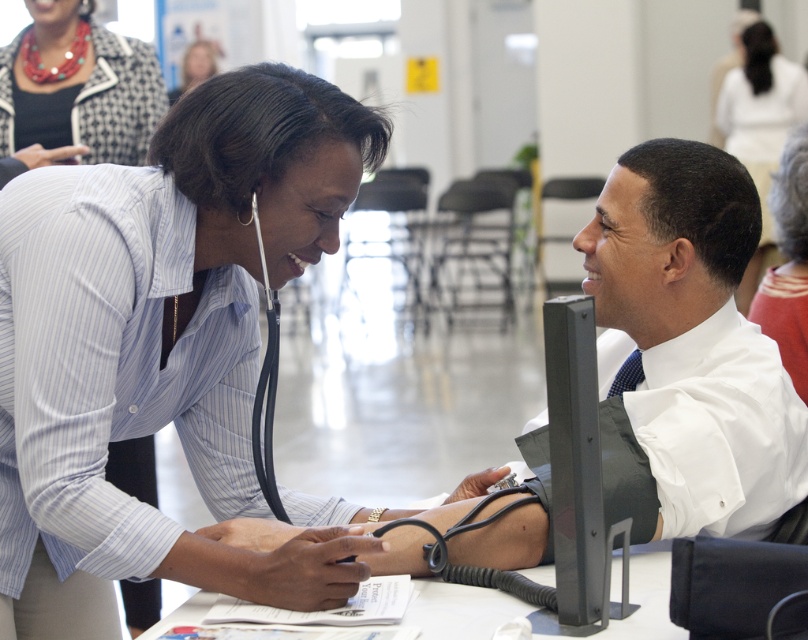
Question: Estimate the real-world distances between objects in this image. Which object is farther from the gray striped shirt at upper right?

Choices:
 (A) matte black necklace at upper left
 (B) smooth skin face at upper center

Answer: (B)

Question: Can you confirm if matte blue shirt at center is smaller than white fabric shirt at upper right?

Choices:
 (A) no
 (B) yes

Answer: (B)

Question: Considering the real-world distances, which object is closest to the smooth skin face at upper center?

Choices:
 (A) gray striped shirt at upper right
 (B) matte black necklace at upper left

Answer: (B)

Question: Where is matte blue shirt at center located in relation to smooth skin face at upper center in the image?

Choices:
 (A) left
 (B) right

Answer: (B)

Question: Which object appears closest to the camera in this image?

Choices:
 (A) smooth skin face at upper center
 (B) matte blue shirt at center
 (C) gray striped shirt at upper right
 (D) white fabric shirt at upper right

Answer: (B)

Question: Does matte black necklace at upper left appear over smooth skin face at upper center?

Choices:
 (A) no
 (B) yes

Answer: (A)